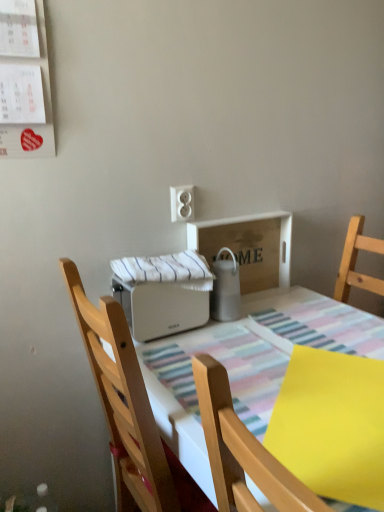
This screenshot has width=384, height=512. Find the location of `wooden chair at center`. wooden chair at center is located at coordinates (123, 403).

Locate an element on the screen. This screenshot has width=384, height=512. yellow matte paper at lower right is located at coordinates (332, 425).

What do you see at coordinates (332, 425) in the screenshot? Image resolution: width=384 pixels, height=512 pixels. I see `yellow matte paper at lower right` at bounding box center [332, 425].

At what (x,y) coordinates should I click in order to perform the action: click on white plastic toaster at center. Please return your answer as a coordinate pair (x, y). Looking at the image, I should click on point(245,364).

Find the location of a particular element. This screenshot has width=384, height=512. white matte toaster at center, which is counted as the 2th appliance, starting from the right is located at coordinates (160, 308).

Considering the sizes of objects wooden chair at center and white plastic toaster at center in the image provided, who is bigger, wooden chair at center or white plastic toaster at center?

white plastic toaster at center.

From the image's perspective, does wooden chair at center appear lower than white plastic toaster at center?

No, from the image's perspective, wooden chair at center is not below white plastic toaster at center.

Is wooden chair at center next to white plastic toaster at center and touching it?

No, wooden chair at center is not making contact with white plastic toaster at center.

Would you say white plastic toaster at center is part of wooden chair at center's contents?

No, white plastic toaster at center is not a part of wooden chair at center.

Is the surface of satin silver thermos at center, arranged as the first appliance when viewed from the right, in direct contact with yellow matte paper at lower right?

satin silver thermos at center, arranged as the first appliance when viewed from the right, and yellow matte paper at lower right are not in contact.

Is satin silver thermos at center, which is the 2th appliance in left-to-right order, at the right side of yellow matte paper at lower right?

In fact, satin silver thermos at center, which is the 2th appliance in left-to-right order, is to the left of yellow matte paper at lower right.

Could you measure the distance between satin silver thermos at center, which is the 2th appliance in left-to-right order, and yellow matte paper at lower right?

satin silver thermos at center, which is the 2th appliance in left-to-right order, and yellow matte paper at lower right are 19.13 inches apart.

Between satin silver thermos at center, which is the 2th appliance in left-to-right order, and yellow matte paper at lower right, which one has more height?

Standing taller between the two is satin silver thermos at center, which is the 2th appliance in left-to-right order.

Does white plastic outlet at upper center turn towards satin silver thermos at center, arranged as the first appliance when viewed from the right?

No, white plastic outlet at upper center is not turned towards satin silver thermos at center, arranged as the first appliance when viewed from the right.

Can you confirm if white plastic outlet at upper center is wider than satin silver thermos at center, arranged as the first appliance when viewed from the right?

Incorrect, the width of white plastic outlet at upper center does not surpass that of satin silver thermos at center, arranged as the first appliance when viewed from the right.

Relative to satin silver thermos at center, arranged as the first appliance when viewed from the right, is white plastic outlet at upper center in front or behind?

In the image, white plastic outlet at upper center appears behind satin silver thermos at center, arranged as the first appliance when viewed from the right.

The width and height of the screenshot is (384, 512). I want to click on appliance on the right side of white plastic outlet at upper center, so click(x=225, y=289).

Locate an element on the screen. The image size is (384, 512). appliance behind the white matte toaster at center, arranged as the first appliance when viewed from the left is located at coordinates (225, 289).

Is satin silver thermos at center, which is the 2th appliance in left-to-right order, aimed at white matte toaster at center, arranged as the first appliance when viewed from the left?

No, satin silver thermos at center, which is the 2th appliance in left-to-right order, is not oriented towards white matte toaster at center, arranged as the first appliance when viewed from the left.

From the image's perspective, between satin silver thermos at center, arranged as the first appliance when viewed from the right, and white matte toaster at center, arranged as the first appliance when viewed from the left, which one is located above?

From the image's view, satin silver thermos at center, arranged as the first appliance when viewed from the right, is above.

Which is in front, point (238, 296) or point (171, 308)?

Point (171, 308)

Image resolution: width=384 pixels, height=512 pixels. Identify the location of electric outlet that is behind the yellow matte paper at lower right. (182, 203).

Choose the correct answer: Is white plastic outlet at upper center inside yellow matte paper at lower right or outside it?

white plastic outlet at upper center lies outside yellow matte paper at lower right.

Can you see white plastic outlet at upper center touching yellow matte paper at lower right?

white plastic outlet at upper center is not next to yellow matte paper at lower right, and they're not touching.

Is white matte toaster at center, arranged as the first appliance when viewed from the left, facing away from wooden tray at center?

No, white matte toaster at center, arranged as the first appliance when viewed from the left,'s orientation is not away from wooden tray at center.

Consider the image. Which is closer to the camera, [148,332] or [264,283]?

The point [148,332] is more forward.

Identify the location of cardboard box positioned vertically above the white matte toaster at center, which is counted as the 2th appliance, starting from the right (from a real-world perspective). (249, 247).

Is white matte toaster at center, which is counted as the 2th appliance, starting from the right, surrounding wooden tray at center?

No, wooden tray at center is not inside white matte toaster at center, which is counted as the 2th appliance, starting from the right.

From the picture: From the image's perspective, which one is positioned higher, yellow matte paper at lower right or satin silver thermos at center, arranged as the first appliance when viewed from the right?

satin silver thermos at center, arranged as the first appliance when viewed from the right, appears higher in the image.

From a real-world perspective, is yellow matte paper at lower right physically located above or below satin silver thermos at center, arranged as the first appliance when viewed from the right?

yellow matte paper at lower right is below satin silver thermos at center, arranged as the first appliance when viewed from the right.

Does yellow matte paper at lower right have a lesser width compared to satin silver thermos at center, which is the 2th appliance in left-to-right order?

Incorrect, the width of yellow matte paper at lower right is not less than that of satin silver thermos at center, which is the 2th appliance in left-to-right order.

Are yellow matte paper at lower right and satin silver thermos at center, which is the 2th appliance in left-to-right order, far apart?

No, yellow matte paper at lower right is not far away from satin silver thermos at center, which is the 2th appliance in left-to-right order.

Where is `kitchen & dining room table located underneath the wooden chair at center (from a real-world perspective)`? Image resolution: width=384 pixels, height=512 pixels. kitchen & dining room table located underneath the wooden chair at center (from a real-world perspective) is located at coordinates (245, 364).

The image size is (384, 512). I want to click on appliance that is the 2nd object above the yellow matte paper at lower right (from a real-world perspective), so click(225, 289).

From the image, which object appears to be nearer to white matte toaster at center, arranged as the first appliance when viewed from the left, wooden tray at center or yellow matte paper at lower right?

The object closer to white matte toaster at center, arranged as the first appliance when viewed from the left, is wooden tray at center.

Which object lies nearer to the anchor point wooden chair at center, yellow matte paper at lower right or white plastic outlet at upper center?

The object closer to wooden chair at center is yellow matte paper at lower right.

Based on their spatial positions, is wooden tray at center or yellow matte paper at lower right closer to white plastic outlet at upper center?

wooden tray at center is positioned closer to the anchor white plastic outlet at upper center.

Which object lies nearer to the anchor point wooden tray at center, wooden chair at center or satin silver thermos at center, arranged as the first appliance when viewed from the right?

Based on the image, satin silver thermos at center, arranged as the first appliance when viewed from the right, appears to be nearer to wooden tray at center.

From the image, which object appears to be farther from yellow matte paper at lower right, white plastic toaster at center or white matte toaster at center, which is counted as the 2th appliance, starting from the right?

white matte toaster at center, which is counted as the 2th appliance, starting from the right, lies further to yellow matte paper at lower right than the other object.

Considering their positions, is white plastic toaster at center positioned closer to wooden tray at center than satin silver thermos at center, which is the 2th appliance in left-to-right order?

satin silver thermos at center, which is the 2th appliance in left-to-right order, is closer to wooden tray at center.

From the image, which object appears to be nearer to white matte toaster at center, which is counted as the 2th appliance, starting from the right, yellow matte paper at lower right or satin silver thermos at center, which is the 2th appliance in left-to-right order?

satin silver thermos at center, which is the 2th appliance in left-to-right order, is closer to white matte toaster at center, which is counted as the 2th appliance, starting from the right.

Looking at the image, which one is located closer to white plastic toaster at center, yellow matte paper at lower right or wooden tray at center?

Result: yellow matte paper at lower right is closer to white plastic toaster at center.

Where is `appliance between white plastic toaster at center and satin silver thermos at center, which is the 2th appliance in left-to-right order, along the z-axis`? The height and width of the screenshot is (512, 384). appliance between white plastic toaster at center and satin silver thermos at center, which is the 2th appliance in left-to-right order, along the z-axis is located at coordinates (160, 308).

The height and width of the screenshot is (512, 384). Identify the location of chair located between yellow matte paper at lower right and white matte toaster at center, which is counted as the 2th appliance, starting from the right, in the depth direction. (123, 403).

Identify the location of sheet between white plastic toaster at center and white plastic outlet at upper center in the front-back direction. Image resolution: width=384 pixels, height=512 pixels. (332, 425).

Where is `chair between yellow matte paper at lower right and white plastic outlet at upper center from front to back`? This screenshot has width=384, height=512. chair between yellow matte paper at lower right and white plastic outlet at upper center from front to back is located at coordinates (123, 403).